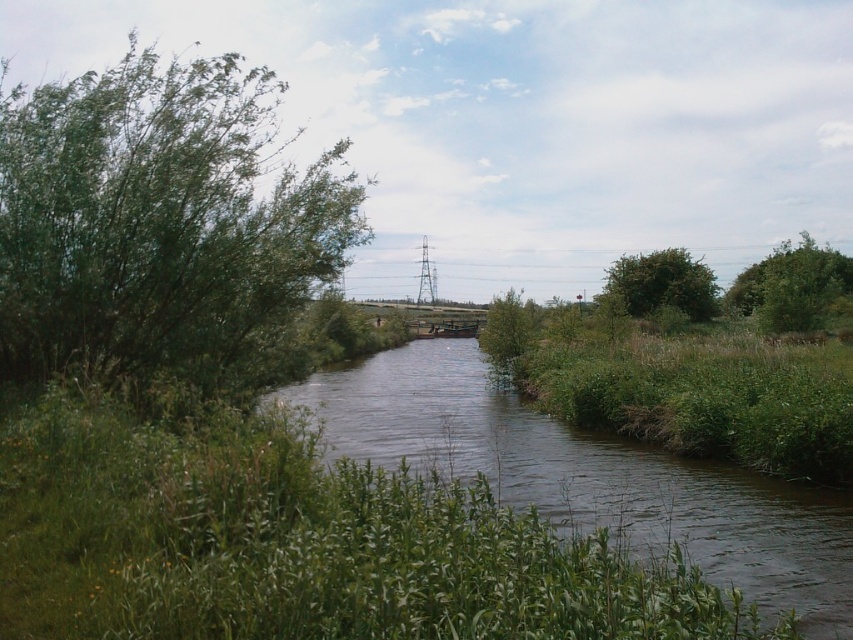
Question: Which object is positioned farthest from the green leafy bush at left?

Choices:
 (A) green leafy tree at upper right
 (B) green leafy bush at right
 (C) green leafy tree at center
 (D) dark green grass at center

Answer: (B)

Question: Can you confirm if green leafy bush at left is positioned to the left of green leafy tree at center?

Choices:
 (A) yes
 (B) no

Answer: (A)

Question: Is green leafy tree at upper right wider than green leafy tree at center?

Choices:
 (A) no
 (B) yes

Answer: (B)

Question: Among these objects, which one is nearest to the camera?

Choices:
 (A) green leafy tree at center
 (B) green leafy tree at upper right
 (C) green leafy bush at left
 (D) dark green grass at center

Answer: (D)

Question: Which of the following is the closest to the observer?

Choices:
 (A) (245, 337)
 (B) (805, 618)
 (C) (827, 262)

Answer: (B)

Question: Considering the relative positions of green leafy bush at left and green leafy tree at upper right in the image provided, where is green leafy bush at left located with respect to green leafy tree at upper right?

Choices:
 (A) right
 (B) left

Answer: (B)